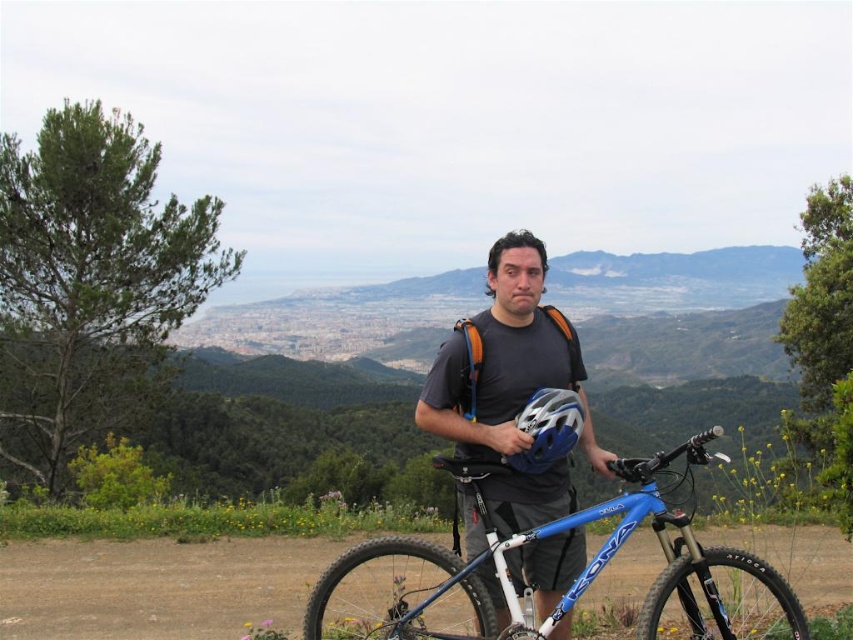
Question: Which of the following is the closest to the observer?

Choices:
 (A) (517, 380)
 (B) (480, 540)

Answer: (B)

Question: Is blue metallic bicycle at center positioned behind matte black helmet at center?

Choices:
 (A) no
 (B) yes

Answer: (A)

Question: Considering the relative positions of blue metallic bicycle at center and blue/white matte bicycle helmet at center in the image provided, where is blue metallic bicycle at center located with respect to blue/white matte bicycle helmet at center?

Choices:
 (A) below
 (B) above

Answer: (A)

Question: Among these points, which one is farthest from the camera?

Choices:
 (A) (456, 627)
 (B) (549, 416)
 (C) (534, 342)

Answer: (A)

Question: From the image, what is the correct spatial relationship of blue metallic bicycle at center in relation to blue/white matte bicycle helmet at center?

Choices:
 (A) below
 (B) above

Answer: (A)

Question: Which of the following is the closest to the observer?

Choices:
 (A) matte black helmet at center
 (B) blue/white matte bicycle helmet at center
 (C) blue metallic bicycle at center

Answer: (C)